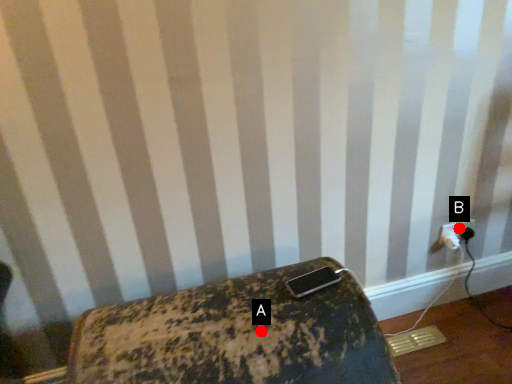
Question: Two points are circled on the image, labeled by A and B beside each circle. Which point is farther from the camera taking this photo?

Choices:
 (A) A is further
 (B) B is further

Answer: (B)